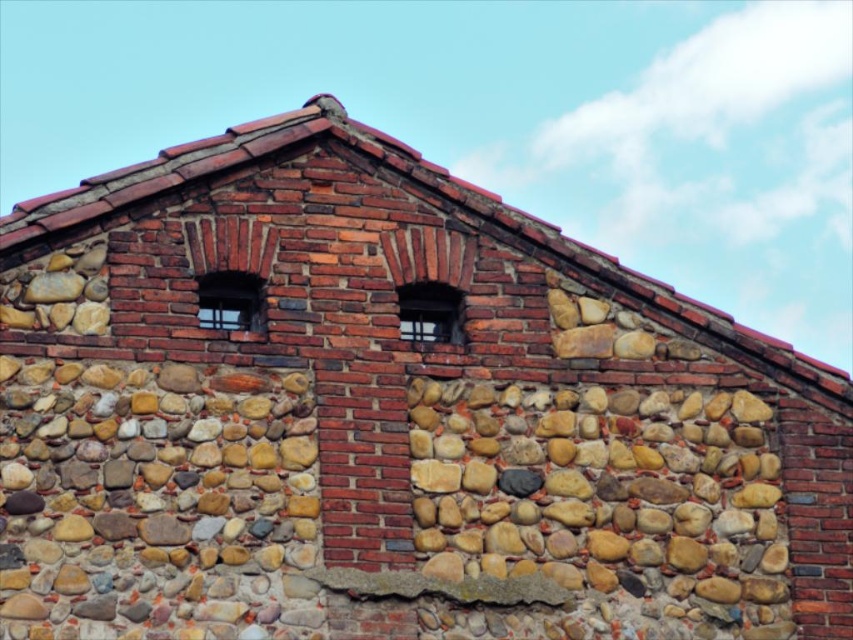
You are standing 50 meters away from a building. You want to know if you can see the matte glass window at center clearly from your current position. The window is 1 meter in height. Can you see it clearly?

The matte glass window at center is 50.43 meters away from the camera, which is slightly further than your current distance of 50 meters. Since the window is only 1 meter tall, it might be difficult to see clearly from that distance due to the limitations of human visual acuity at such ranges.

You are an architect designing a new building that needs to maintain the same spacing between its two windows as the one shown in the image. The two windows in the image are the matte glass window at center and the clear glass window at upper center. What should be the minimum distance you should leave between the two windows in your design?

The distance between the matte glass window at center and the clear glass window at upper center in the image is 4.19 meters, so the minimum distance you should leave between the two windows in your design is 4.19 meters to maintain the same spacing.

You are standing in front of the building and want to determine which of the two points, point (x=433, y=300) or point (x=236, y=292), is closer to you. Based on the image, which point is nearer?

Point (x=433, y=300) is further to the viewer than point (x=236, y=292), so the closer point is point (x=236, y=292).